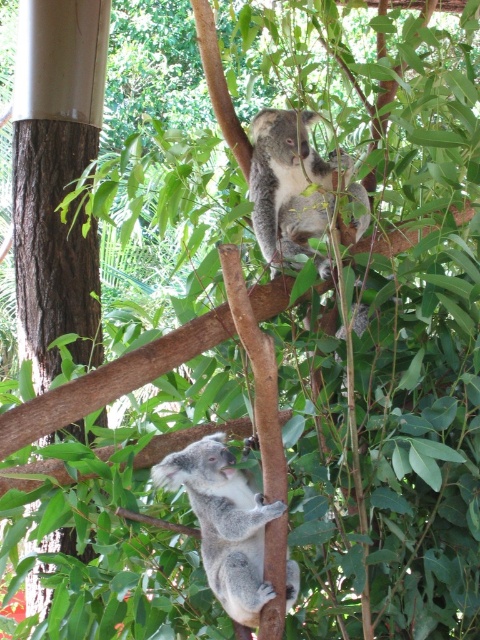
Is fuzzy gray koala at lower center smaller than fuzzy gray koala at upper center?

Indeed, fuzzy gray koala at lower center has a smaller size compared to fuzzy gray koala at upper center.

Is fuzzy gray koala at lower center bigger than fuzzy gray koala at upper center?

Incorrect, fuzzy gray koala at lower center is not larger than fuzzy gray koala at upper center.

Who is more distant from viewer, (222,509) or (309,236)?

Point (309,236)

Locate an element on the screen. This screenshot has height=640, width=480. fuzzy gray koala at lower center is located at coordinates (224, 522).